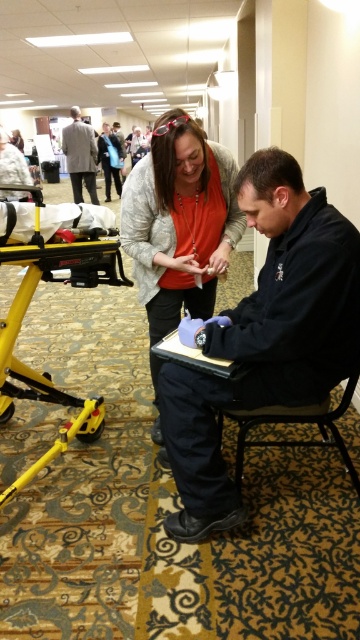
Can you confirm if black matte jacket at center is taller than light gray suit at upper left?

No.

Which is more to the right, black matte jacket at center or light gray suit at upper left?

black matte jacket at center

This screenshot has width=360, height=640. Describe the element at coordinates (263, 337) in the screenshot. I see `black matte jacket at center` at that location.

Where is `black matte jacket at center`? This screenshot has width=360, height=640. black matte jacket at center is located at coordinates (263, 337).

Is matte gray sweater at center thinner than metallic blue chair at lower center?

Correct, matte gray sweater at center's width is less than metallic blue chair at lower center's.

Is matte gray sweater at center further to the viewer compared to metallic blue chair at lower center?

Yes, it is.

Find the location of `matte gray sweater at center`. matte gray sweater at center is located at coordinates (180, 221).

The height and width of the screenshot is (640, 360). I want to click on matte gray sweater at center, so click(180, 221).

Is yellow metallic stretcher at lower left taller than metallic blue chair at lower center?

Indeed, yellow metallic stretcher at lower left has a greater height compared to metallic blue chair at lower center.

Does point (56, 394) come in front of point (245, 429)?

That is False.

Identify the location of yellow metallic stretcher at lower left. This screenshot has width=360, height=640. (27, 308).